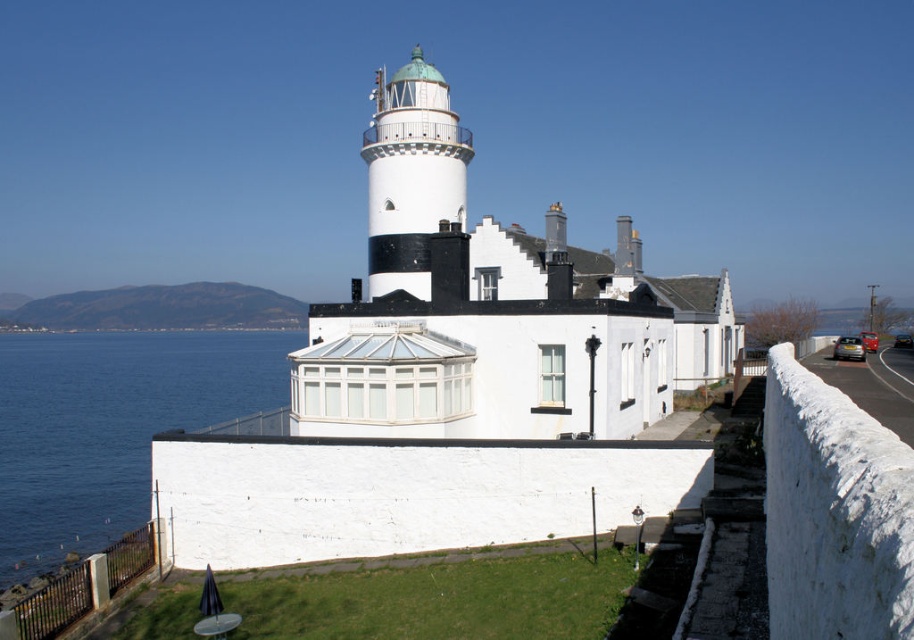
You are standing at the center of the lighthouse and want to get to the blue water at lower left. Which direction should you walk to reach it?

You should walk towards the lower left direction to reach the blue water at lower left.